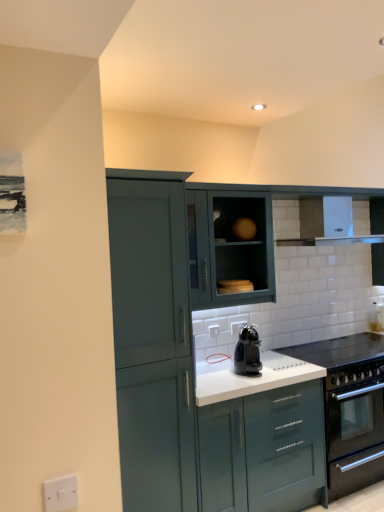
Identify the location of vacant space positioned to the left of black plastic coffee machine at center. The height and width of the screenshot is (512, 384). (237, 378).